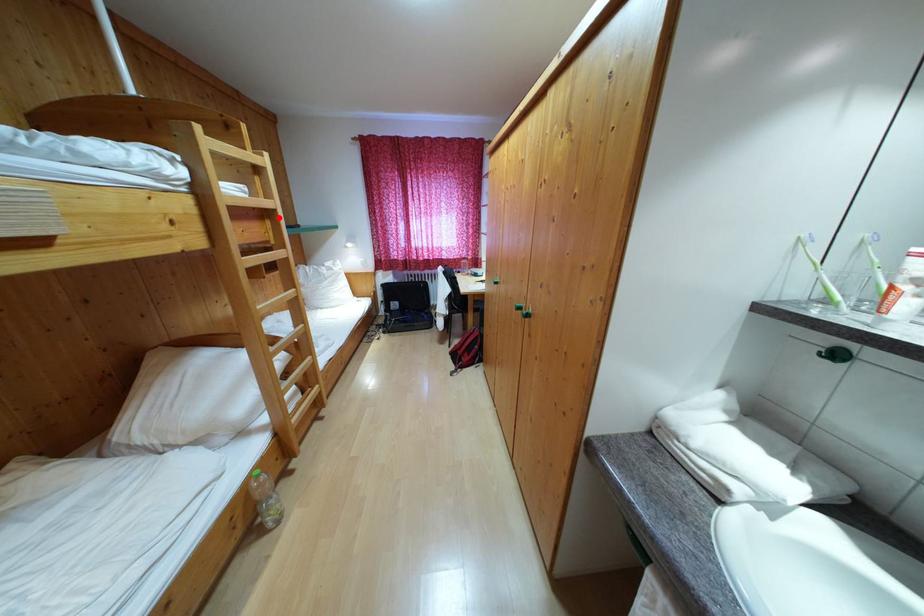
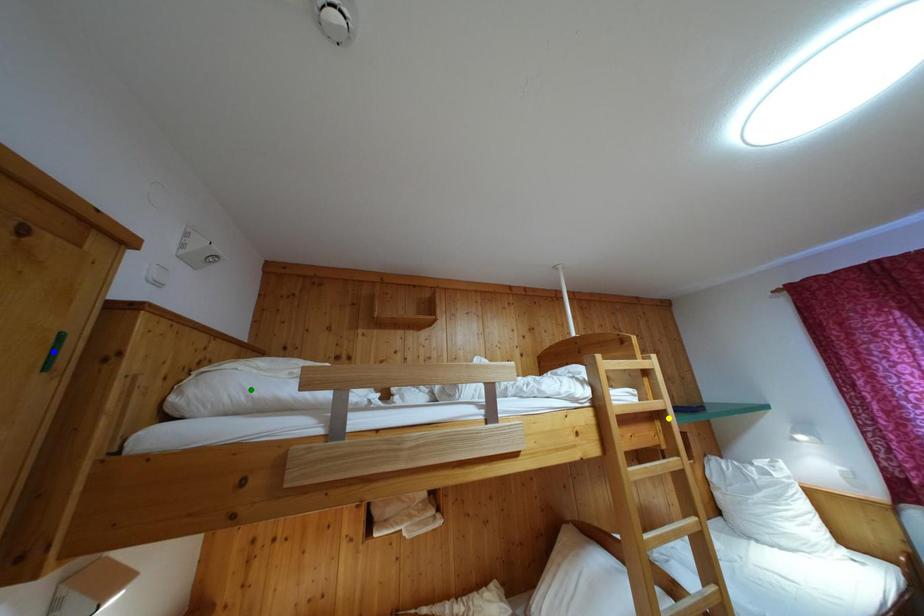
Question: I am providing you with two images of the same scene from different viewpoints. A red point is marked on the first image. You are given multiple points on the second image. Which point in image 2 is actually the same real-world point as the red point in image 1?

Choices:
 (A) green point
 (B) yellow point
 (C) blue point

Answer: (B)